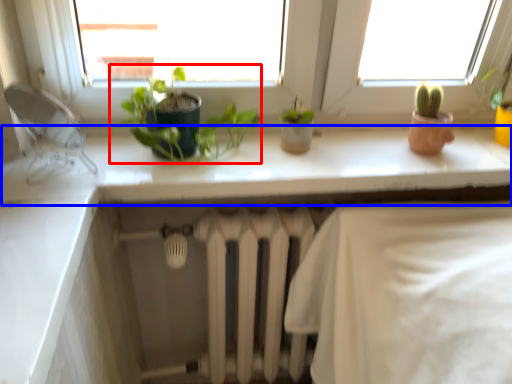
Question: Which of the following is the farthest to the observer, houseplant (highlighted by a red box) or counter top (highlighted by a blue box)?

Choices:
 (A) houseplant
 (B) counter top

Answer: (B)